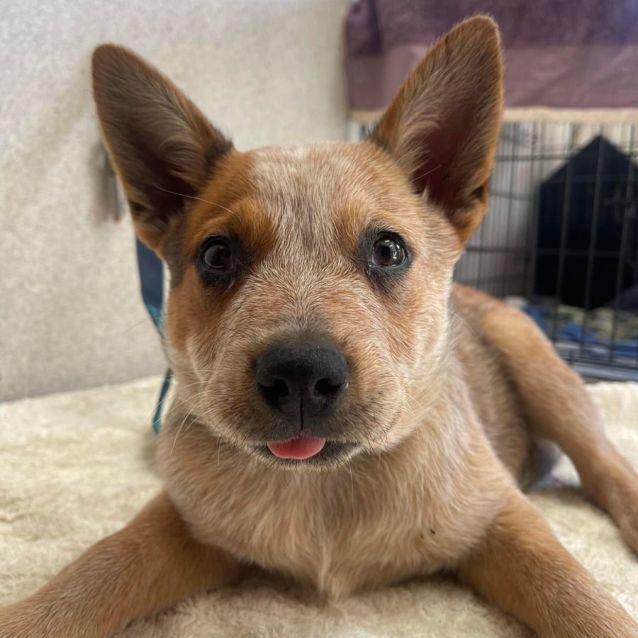
Where is `white wall`? white wall is located at coordinates click(x=41, y=67).